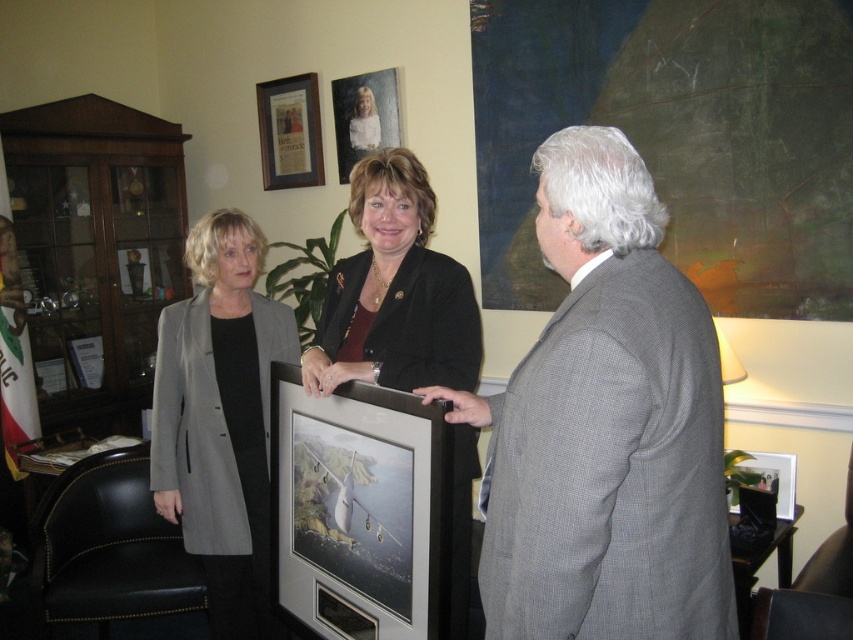
Question: Among these points, which one is farthest from the camera?

Choices:
 (A) (340, 147)
 (B) (727, 595)
 (C) (401, 358)

Answer: (A)

Question: Can you confirm if matte black blazer at center is wider than black matte blazer at center?

Choices:
 (A) no
 (B) yes

Answer: (B)

Question: Does matte gray picture frame at center have a lesser width compared to black matte blazer at center?

Choices:
 (A) yes
 (B) no

Answer: (B)

Question: Which of the following is the farthest from the observer?

Choices:
 (A) matte gray picture frame at center
 (B) metallic silver frame at upper center

Answer: (B)

Question: Does matte glass picture frame at upper center have a smaller size compared to metallic silver picture frame at center?

Choices:
 (A) yes
 (B) no

Answer: (B)

Question: Estimate the real-world distances between objects in this image. Which object is farther from the metallic silver frame at upper center?

Choices:
 (A) metallic silver picture frame at center
 (B) matte gray picture frame at center

Answer: (A)